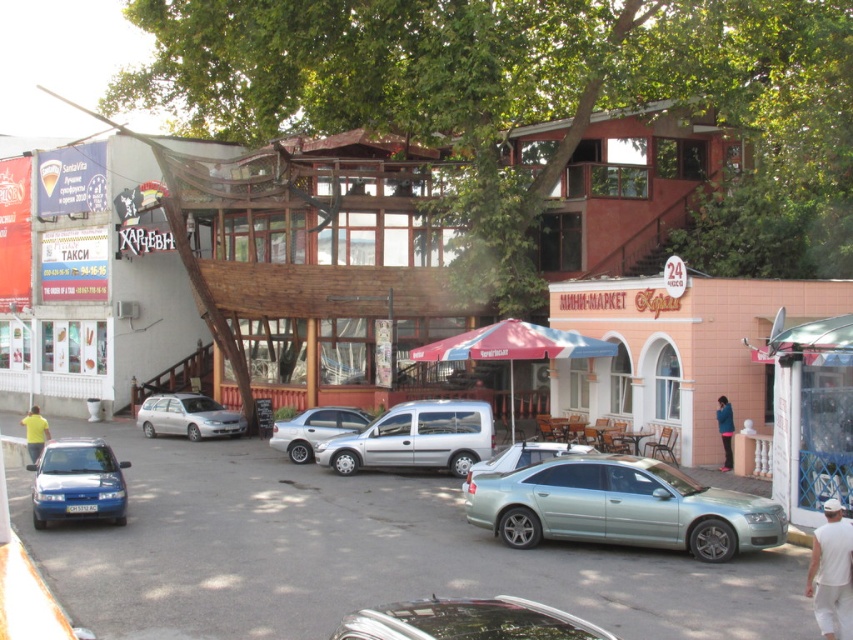
Question: Is silver metallic sedan at center above satin silver sedan at center?

Choices:
 (A) no
 (B) yes

Answer: (A)

Question: Is yellow matte shirt at lower left thinner than dark blue fabric jacket at lower right?

Choices:
 (A) no
 (B) yes

Answer: (A)

Question: Is silver metallic sedan at center bigger than dark blue fabric jacket at lower right?

Choices:
 (A) yes
 (B) no

Answer: (A)

Question: Which point appears farthest from the camera in this image?

Choices:
 (A) (567, 632)
 (B) (120, 502)

Answer: (B)

Question: Among these objects, which one is farthest from the camera?

Choices:
 (A) dark blue fabric jacket at lower right
 (B) silver metallic sedan at center

Answer: (B)

Question: Which of these objects is positioned farthest from the silver metallic sedan at center?

Choices:
 (A) blue metallic hatchback at lower left
 (B) dark blue fabric jacket at lower right

Answer: (B)